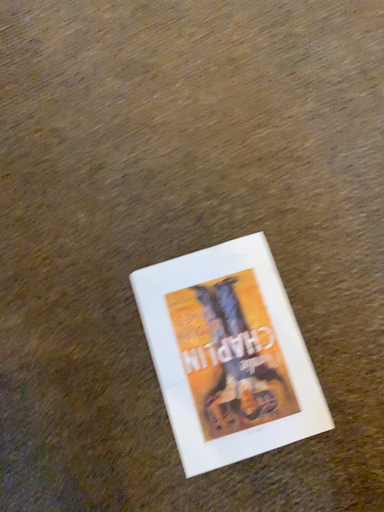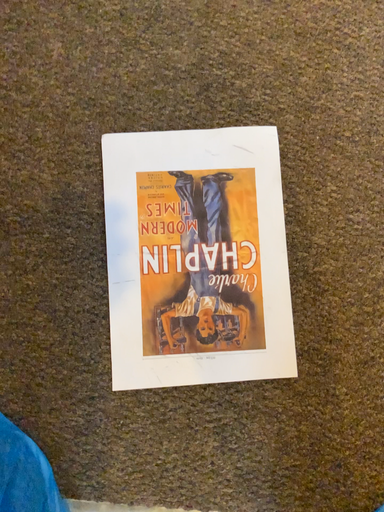
Question: Which way did the camera rotate in the video?

Choices:
 (A) rotated upward
 (B) rotated downward

Answer: (B)